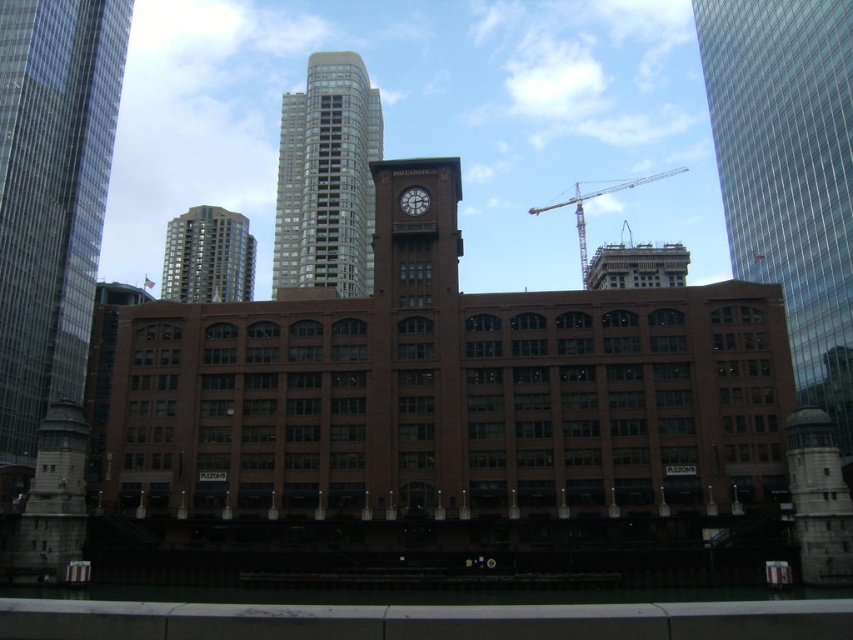
Which is below, glassy reflective skyscraper at left or yellow metallic crane at upper center?

glassy reflective skyscraper at left is below.

Does glassy reflective skyscraper at left appear on the right side of yellow metallic crane at upper center?

Incorrect, glassy reflective skyscraper at left is not on the right side of yellow metallic crane at upper center.

Is point (28, 184) behind point (637, 184)?

No.

The height and width of the screenshot is (640, 853). I want to click on glassy reflective skyscraper at left, so click(x=51, y=196).

Is glassy reflective skyscraper at left closer to the viewer compared to gold glass tower at upper center?

Yes.

Which is below, glassy reflective skyscraper at left or gold glass tower at upper center?

gold glass tower at upper center is below.

Locate an element on the screen. This screenshot has height=640, width=853. glassy reflective skyscraper at left is located at coordinates (51, 196).

Does glassy reflective skyscraper at upper center come behind matte brown clock at center?

Yes, it is.

Looking at this image, does glassy reflective skyscraper at upper center have a larger size compared to matte brown clock at center?

Correct, glassy reflective skyscraper at upper center is larger in size than matte brown clock at center.

Locate an element on the screen. The height and width of the screenshot is (640, 853). glassy reflective skyscraper at upper center is located at coordinates (328, 179).